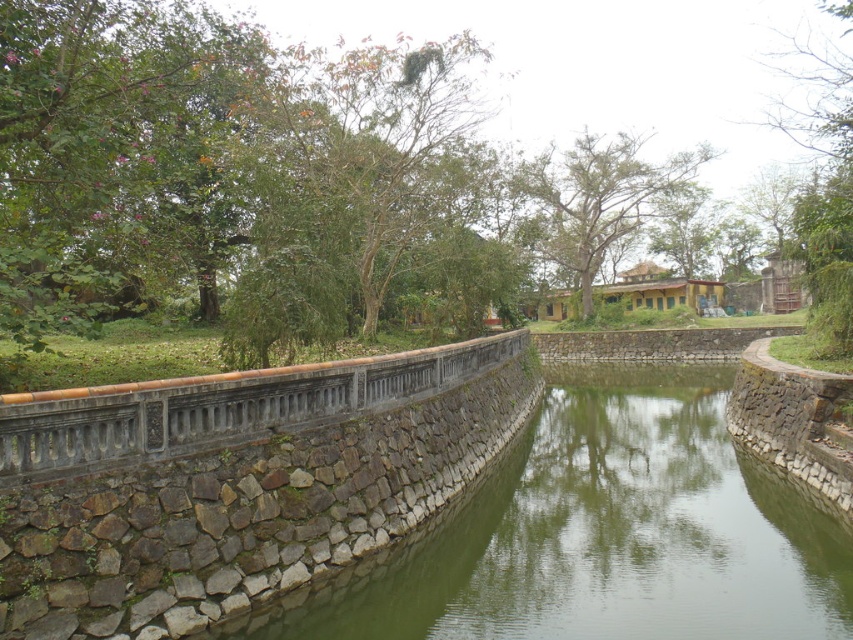
You are standing at the edge of the canal and want to take a photo of the green leafy tree at upper left. If your camera can focus on objects up to 15 meters away, will you be able to capture a clear image of the tree?

The green leafy tree at upper left is 13.87 meters away from the camera. Since the camera can focus up to 15 meters, you can capture a clear image of the tree as it is within the focus range.